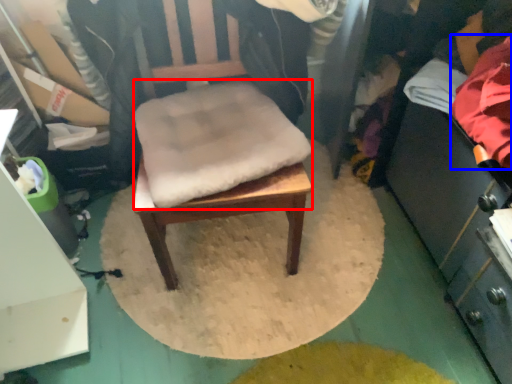
Question: Which object is closer to the camera taking this photo, footrest (highlighted by a red box) or clothing (highlighted by a blue box)?

Choices:
 (A) footrest
 (B) clothing

Answer: (B)